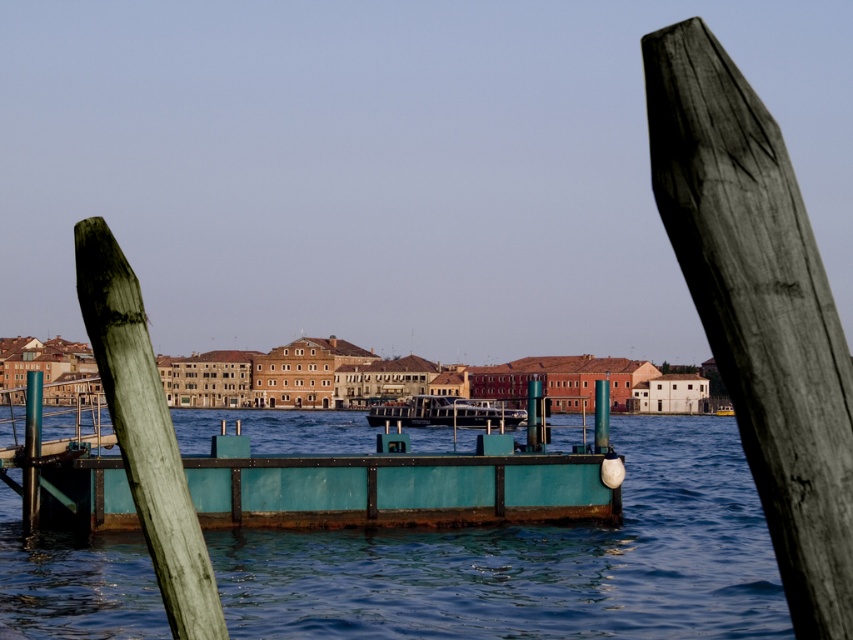
Which is in front, point (595, 445) or point (537, 413)?

Positioned in front is point (595, 445).

Does green painted metal post at center lie in front of metallic green post at center?

Yes, green painted metal post at center is in front of metallic green post at center.

Measure the distance between green painted metal post at center and camera.

green painted metal post at center is 102.79 feet from camera.

This screenshot has width=853, height=640. In order to click on green painted metal post at center in this screenshot , I will do `click(601, 416)`.

Is teal painted wood dock at center positioned in front of rustic wood post at left?

No, it is not.

Is teal painted wood dock at center positioned at the back of rustic wood post at left?

That is True.

Does point (556, 483) lie behind point (170, 506)?

Yes.

You are a GUI agent. You are given a task and a screenshot of the screen. Output one action in this format:
    pyautogui.click(x=<x>, y=<y>)
    Task: Click on the teal painted wood dock at center
    The width and height of the screenshot is (853, 640).
    Given the screenshot: What is the action you would take?
    pyautogui.click(x=397, y=490)

What do you see at coordinates (144, 433) in the screenshot? The width and height of the screenshot is (853, 640). I see `rustic wood post at left` at bounding box center [144, 433].

I want to click on rustic wood post at left, so click(x=144, y=433).